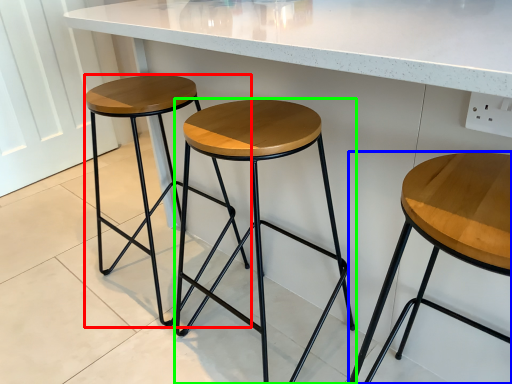
Question: Which is farther away from stool (highlighted by a red box)? stool (highlighted by a blue box) or stool (highlighted by a green box)?

Choices:
 (A) stool
 (B) stool

Answer: (A)